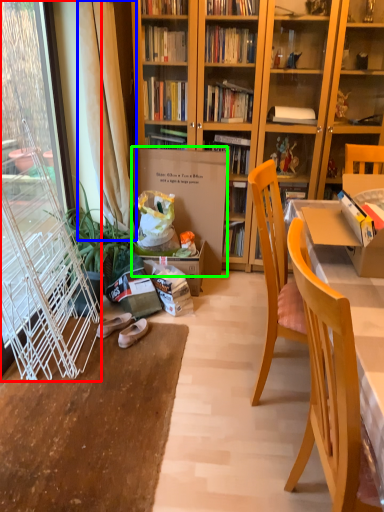
Question: Which object is positioned farthest from screen door (highlighted by a red box)? Select from curtain (highlighted by a blue box) and cardboard box (highlighted by a green box).

Choices:
 (A) curtain
 (B) cardboard box

Answer: (B)